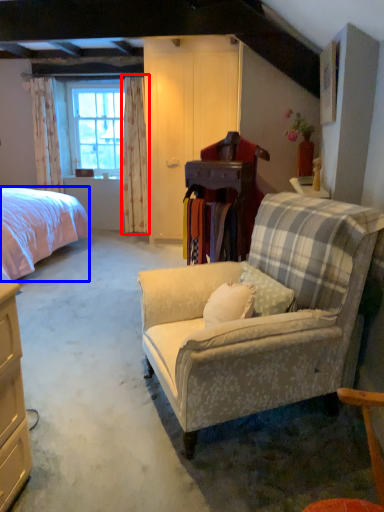
Question: Which object is further to the camera taking this photo, curtain (highlighted by a red box) or bed (highlighted by a blue box)?

Choices:
 (A) curtain
 (B) bed

Answer: (A)